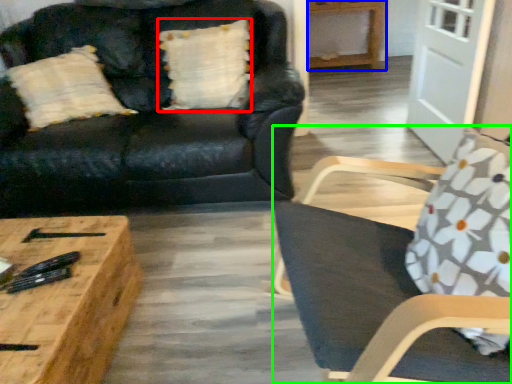
Question: Estimate the real-world distances between objects in this image. Which object is closer to pillow (highlighted by a red box), hardwood (highlighted by a blue box) or chair (highlighted by a green box)?

Choices:
 (A) hardwood
 (B) chair

Answer: (B)